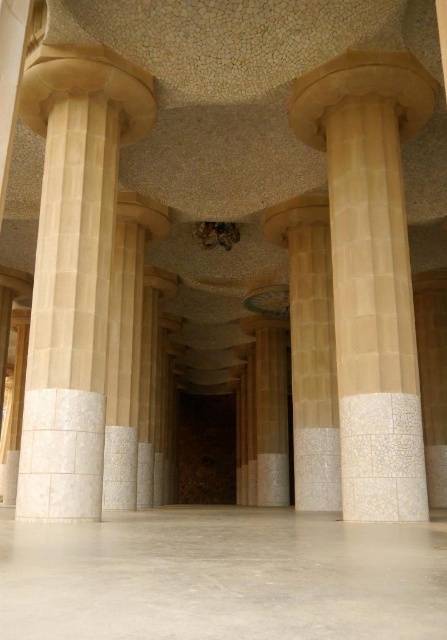
You are standing at the entrance of the room and want to locate the beige marble column at center. According to the coordinates given, where should you look to find it?

The beige marble column at center is located at coordinates point (371, 272).

You are an interior designer assessing the space. You notice the beige marble column at center and the beige stone column at left. Which column would you recommend placing a decorative plant pot next to if you want the pot to appear smaller in comparison?

The beige marble column at center has a larger size compared to beige stone column at left, so placing the decorative plant pot next to the beige marble column at center would make the pot appear smaller in comparison.

You are standing in the interior space and want to take a photo of the beige stone column at left and the beige stone column at center. Which column should you focus on first to ensure both are in the frame?

You should focus on the beige stone column at left first because it is closer to you than the beige stone column at center, so adjusting the camera to include both would require framing starting from the closer one.